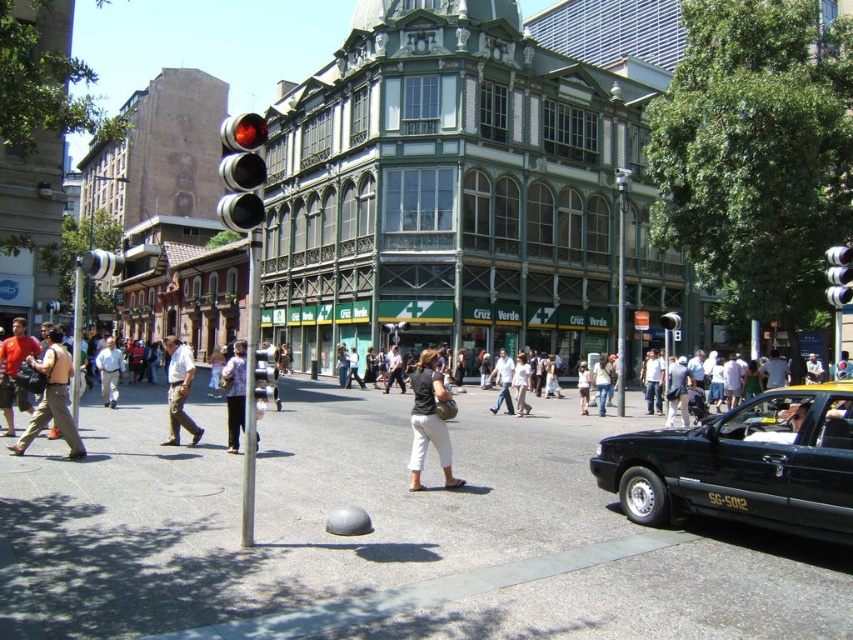
You are a city planner analyzing pedestrian flow. You notice a metallic pole at center and a white cotton shirt at center. Which object is wider from the perspective of someone standing at the traffic light?

The metallic pole at center is wider than the white cotton shirt at center.

You are standing at the intersection and want to determine which of the two points, point (242, 467) or point (524, 392), is nearer to your current position. Based on the scene, can you tell which one is closer?

Point (242, 467) is closer to the camera than point (524, 392), so it is nearer to your current position.